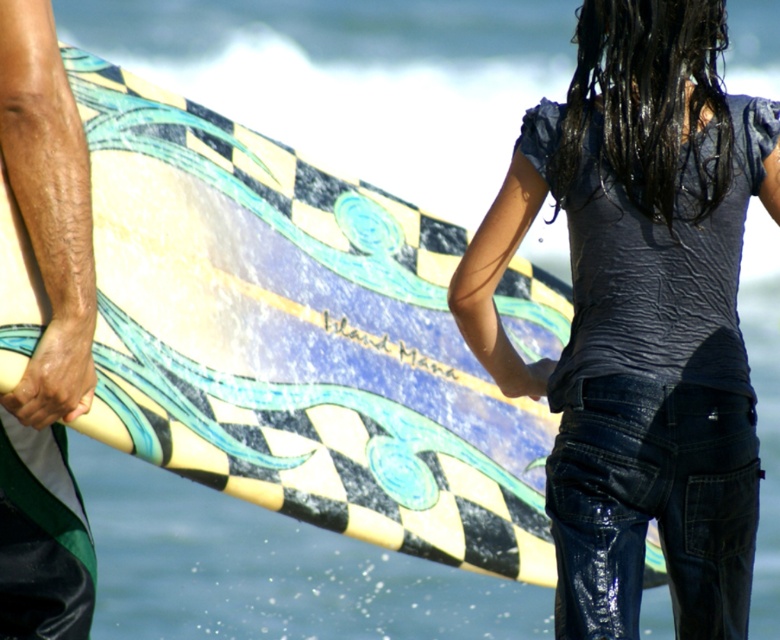
You are a photographer standing at the origin point of the coordinate system. The checkered fabric surfboard at center is at position 0.530, 0.379. If you want to take a photo of the surfboard from the front, which direction should you move to align yourself directly in front of it?

To align yourself directly in front of the checkered fabric surfboard at center, you should move towards the coordinates [295,339]. Since the surfboard is already at the center, moving towards its coordinates would position you directly in front of it for the photo.

You are a photographer trying to capture a shot of both the checkered fabric surfboard at center and the matte black surfboard at lower left. Based on their positions, which surfboard should you adjust your camera angle to include first?

The checkered fabric surfboard at center is to the left of the matte black surfboard at lower left, so you should adjust your camera angle to include the checkered fabric surfboard at center first to ensure both are in frame.